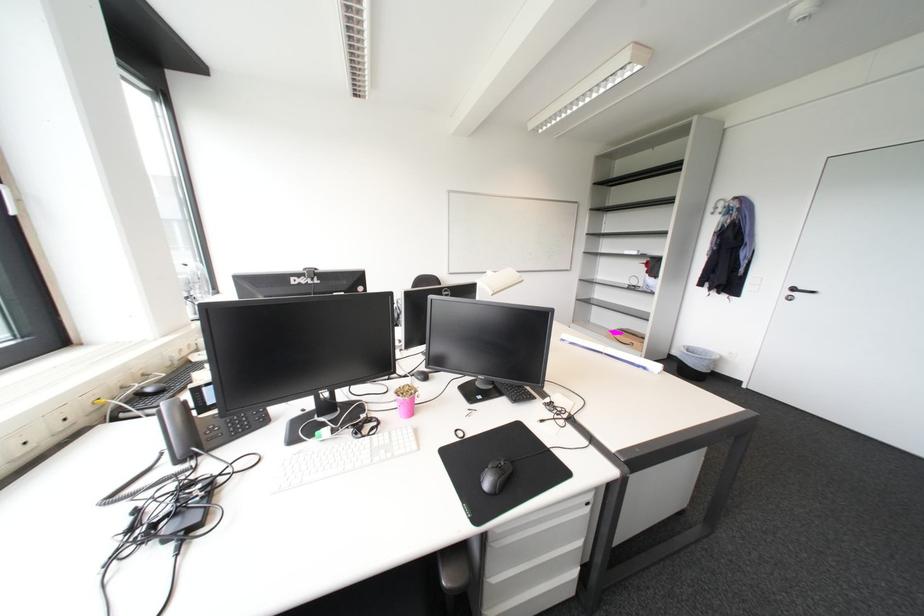
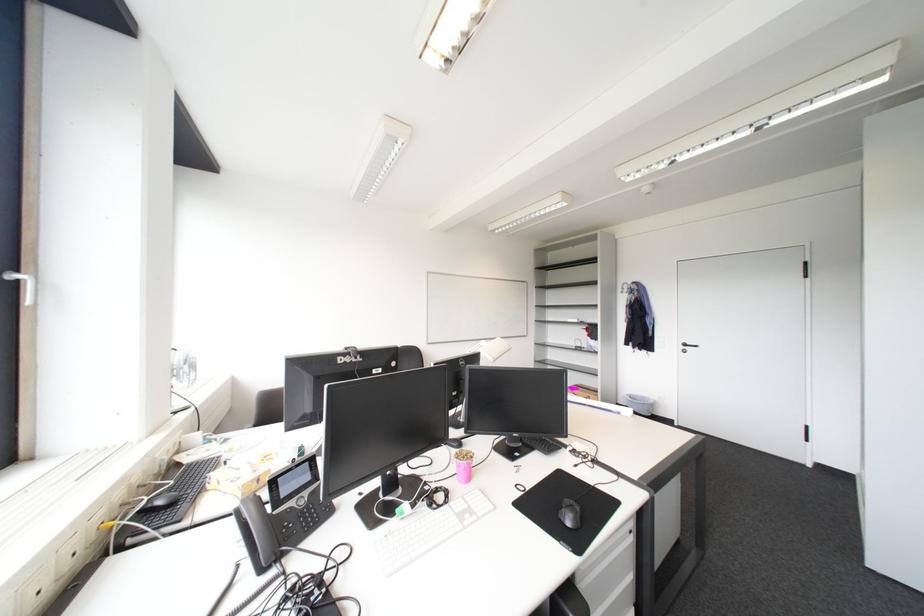
Question: How did the camera likely rotate?

Choices:
 (A) Left
 (B) Right
 (C) Up
 (D) Down

Answer: (C)